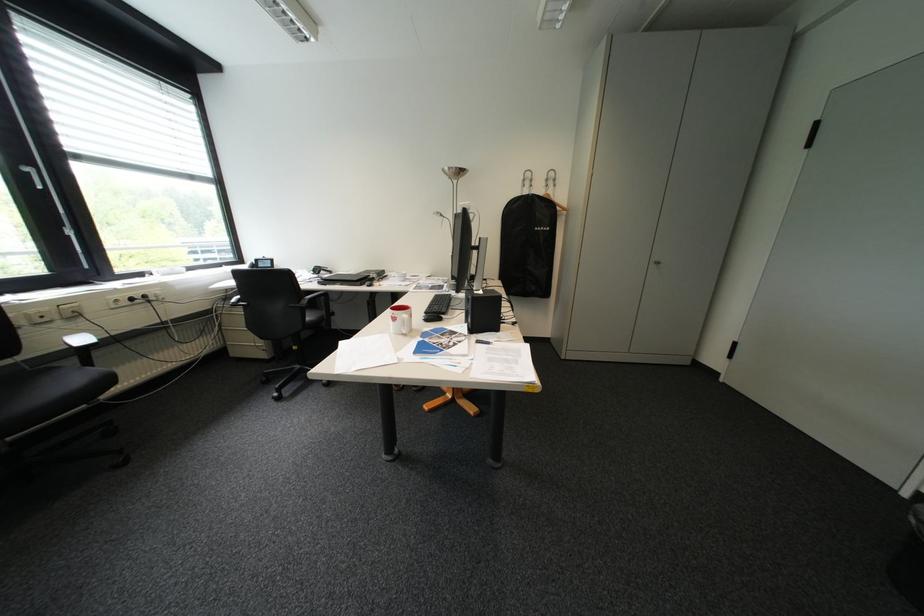
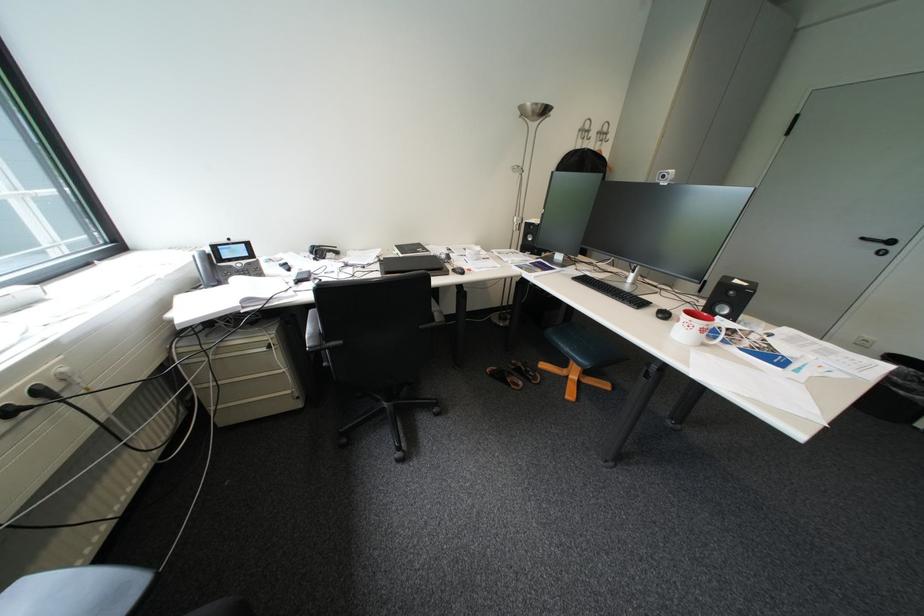
The point at (330, 270) is marked in the first image. Where is the corresponding point in the second image?

(331, 253)